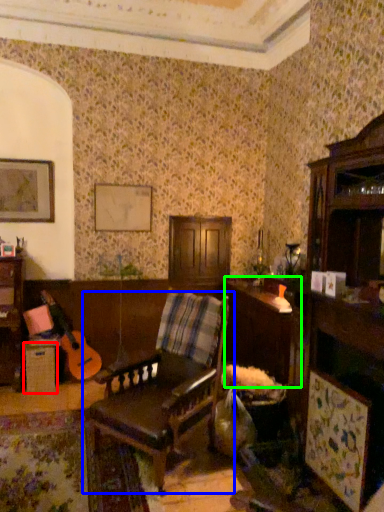
Question: Which object is positioned closest to table (highlighted by a red box)? Select from chair (highlighted by a blue box) and table (highlighted by a green box).

Choices:
 (A) chair
 (B) table

Answer: (A)